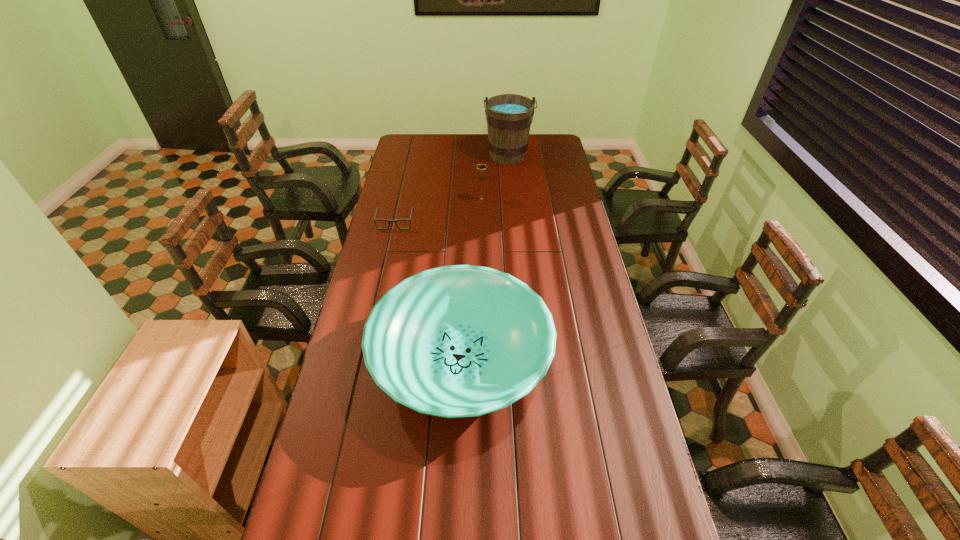
I want to click on the tallest object, so click(509, 117).

In order to click on the farthest object in this screenshot , I will do `click(509, 117)`.

Identify the location of chalice. This screenshot has height=540, width=960. (481, 169).

Where is `the second tallest object`? This screenshot has width=960, height=540. the second tallest object is located at coordinates (481, 169).

The height and width of the screenshot is (540, 960). In order to click on the second shortest object in this screenshot , I will do `click(455, 341)`.

At what (x,y) coordinates should I click in order to perform the action: click on dish. Please return your answer as a coordinate pair (x, y). The image size is (960, 540). Looking at the image, I should click on (455, 341).

Find the location of a particular element. the shortest object is located at coordinates pos(389,221).

Identify the location of spectacles. The height and width of the screenshot is (540, 960). (389, 221).

This screenshot has height=540, width=960. I want to click on vacant region located 0.210m with a handle on the side of the tallest object, so click(511, 193).

I want to click on vacant space located 0.210m on the back of the third shortest object, so click(482, 173).